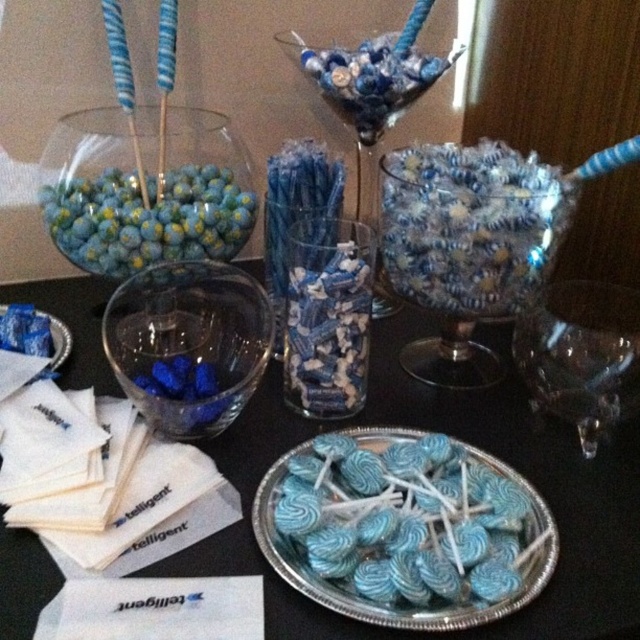
You are planning to place a decorative centerpiece on the table for the event. The table has a black surface, and you need to ensure it aligns with the existing theme. Where should you place the translucent glass bowl at center to maintain the theme and visibility against the black table?

The translucent glass bowl at center is located at point (467, 244), so placing it there would maintain alignment with the theme and ensure visibility against the black table surface.

Based on the photo, you are planning to place a decorative candle between the matte blue lollipops at center and the translucent glass vase at center on the table. The candle requires a minimum of 12 inches of space between them to avoid tipping over. Based on the current setup, will the candle be able to fit safely between them?

The matte blue lollipops at center and translucent glass vase at center are 10.43 inches apart from each other. Since the required minimum space for the candle is 12 inches, the candle will not fit safely between them as the current distance is insufficient.

You are a guest at the party and want to place a small note between the matte blue lollipops at center and the translucent glass vase at center. Based on their heights, which item will you place the note closer to?

The note should be placed closer to the translucent glass vase at center because the matte blue lollipops at center are shorter than the translucent glass vase at center, so the vase is taller and provides a better surface for placement.